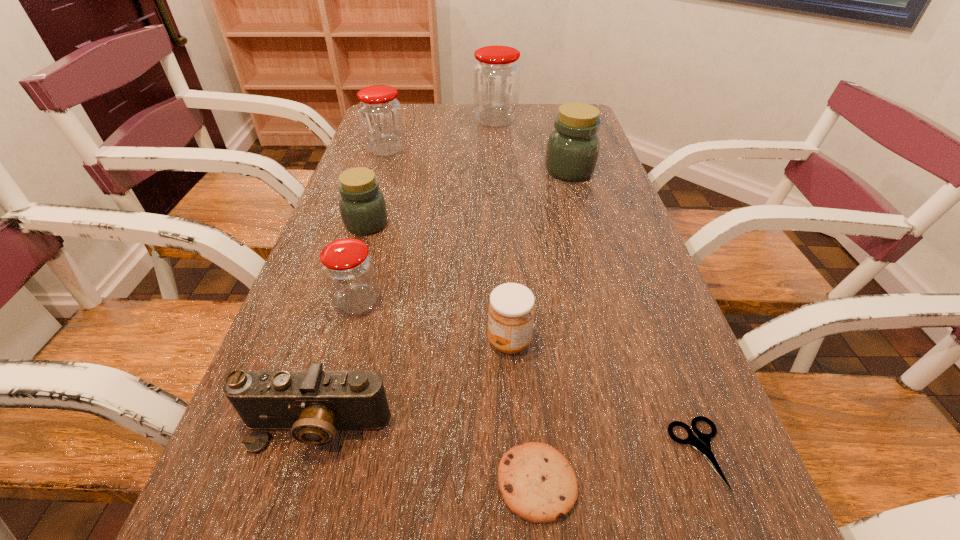
Find the location of a particular element. The width and height of the screenshot is (960, 540). the fifth closest object relative to the tallest jar is located at coordinates (511, 309).

At what (x,y) coordinates should I click in order to perform the action: click on object that stands as the seventh closest to the nearest red jar. Please return your answer as a coordinate pair (x, y). The height and width of the screenshot is (540, 960). Looking at the image, I should click on (572, 151).

I want to click on jar that is the third closest to the orange jam, so click(x=572, y=151).

Locate which jar ranks third in proximity to the rightmost jar. Please provide its 2D coordinates. Your answer should be formatted as a tuple, i.e. [(x, y)], where the tuple contains the x and y coordinates of a point satisfying the conditions above.

[(363, 210)]

This screenshot has height=540, width=960. In order to click on red jar that is the second closest to the nearest jar in this screenshot , I will do [x=496, y=75].

Image resolution: width=960 pixels, height=540 pixels. Identify the location of the third closest red jar to the rightmost jar. (347, 267).

Locate an element on the screen. free space that satisfies the following two spatial constraints: 1. on the front label of the jam; 2. on the front-facing side of the camera is located at coordinates (515, 427).

Locate an element on the screen. This screenshot has width=960, height=540. vacant region that satisfies the following two spatial constraints: 1. on the front label of the second shortest object; 2. on the left side of the fourth nearest object is located at coordinates (518, 482).

Find the location of `vacant position in the image that satisfies the following two spatial constraints: 1. on the front label of the orange jam; 2. on the left side of the eighth tallest object`. vacant position in the image that satisfies the following two spatial constraints: 1. on the front label of the orange jam; 2. on the left side of the eighth tallest object is located at coordinates (518, 482).

Where is `free spot that satisfies the following two spatial constraints: 1. on the front side of the eighth tallest object; 2. on the left side of the second nearest red jar`? free spot that satisfies the following two spatial constraints: 1. on the front side of the eighth tallest object; 2. on the left side of the second nearest red jar is located at coordinates (276, 482).